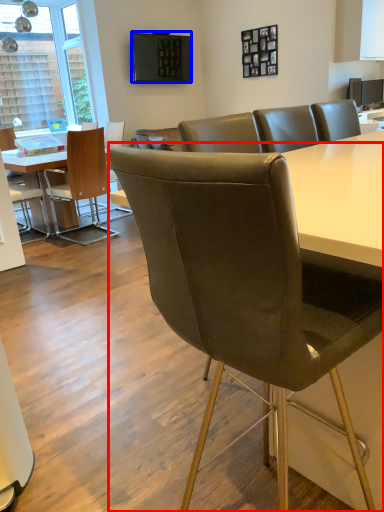
Question: Among these objects, which one is farthest to the camera, chair (highlighted by a red box) or television (highlighted by a blue box)?

Choices:
 (A) chair
 (B) television

Answer: (B)